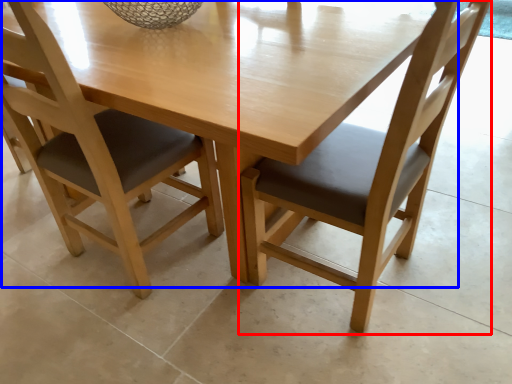
Question: Which of the following is the farthest to the observer, chair (highlighted by a red box) or round table (highlighted by a blue box)?

Choices:
 (A) chair
 (B) round table

Answer: (B)